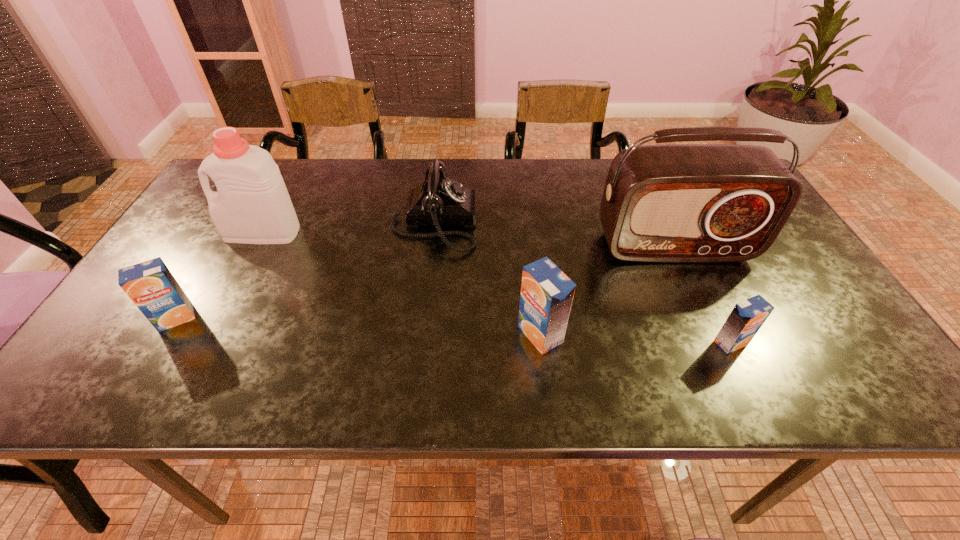
This screenshot has width=960, height=540. What are the coordinates of `vacant space that satisfies the following two spatial constraints: 1. on the front side of the shortest orange_juice; 2. on the left side of the second shortest orange_juice` in the screenshot? It's located at (161, 343).

At what (x,y) coordinates should I click in order to perform the action: click on vacant space that satisfies the following two spatial constraints: 1. on the handle side of the second orange_juice from left to right; 2. on the right side of the detergent. Please return your answer as a coordinate pair (x, y). Image resolution: width=960 pixels, height=540 pixels. Looking at the image, I should click on 209,334.

Identify the location of vacant position in the image that satisfies the following two spatial constraints: 1. on the front panel of the shortest orange_juice; 2. on the left side of the radio receiver. This screenshot has height=540, width=960. (718, 343).

At what (x,y) coordinates should I click in order to perform the action: click on free space that satisfies the following two spatial constraints: 1. on the front panel of the rightmost orange_juice; 2. on the left side of the radio receiver. Please return your answer as a coordinate pair (x, y). Image resolution: width=960 pixels, height=540 pixels. Looking at the image, I should click on (718, 343).